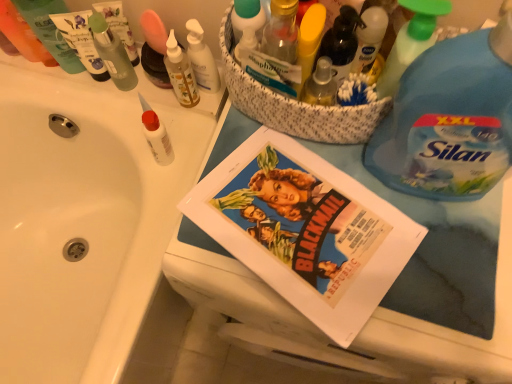
Where is `free space to the left of white matte glue at upper left, the fifth toiletry from the left`? free space to the left of white matte glue at upper left, the fifth toiletry from the left is located at coordinates (111, 122).